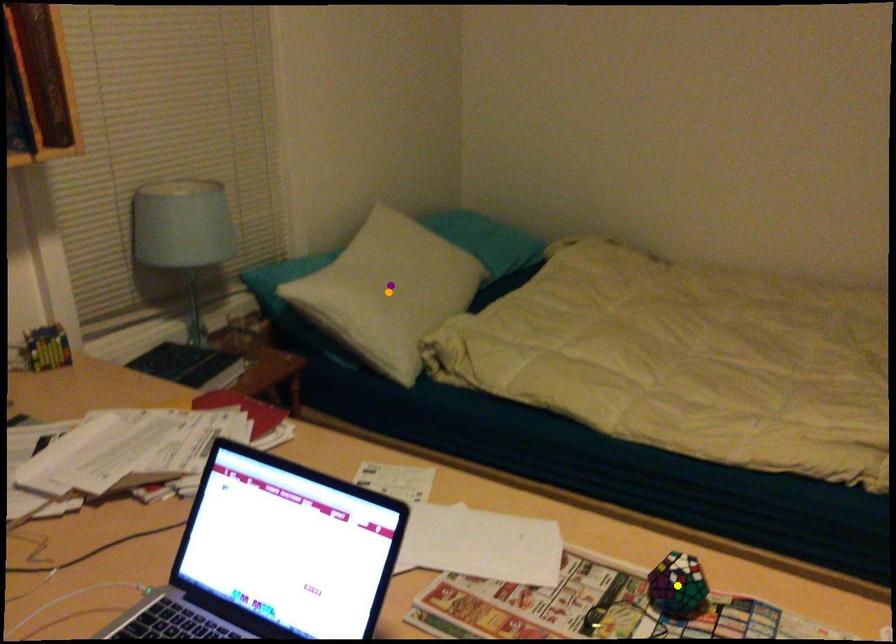
Order these from nearest to farthest:
A) purple point
B) orange point
C) yellow point

yellow point → purple point → orange point